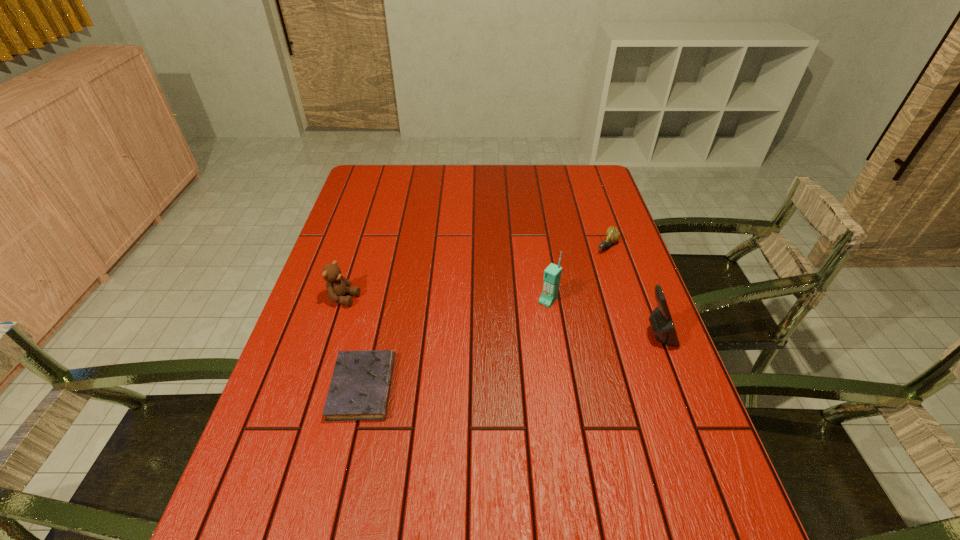
The height and width of the screenshot is (540, 960). Identify the location of free space between the nearest object and the third tallest object. (353, 342).

At what (x,y) coordinates should I click in order to perform the action: click on vacant area that lies between the shortest object and the teddy bear. Please return your answer as a coordinate pair (x, y). This screenshot has width=960, height=540. Looking at the image, I should click on (353, 342).

Locate an element on the screen. The height and width of the screenshot is (540, 960). free area in between the diary and the fourth farthest object is located at coordinates (510, 361).

Where is `vacant area between the second nearest object and the farthest object`? The image size is (960, 540). vacant area between the second nearest object and the farthest object is located at coordinates (632, 291).

Locate an element on the screen. vacant region between the third object from right to left and the right cellular telephone is located at coordinates (603, 318).

The height and width of the screenshot is (540, 960). Find the location of `free space between the diary and the left cellular telephone`. free space between the diary and the left cellular telephone is located at coordinates (455, 343).

What are the coordinates of `vacant space in between the nearer cellular telephone and the shortest object` in the screenshot? It's located at (510, 361).

Where is `blank region between the diary and the farther cellular telephone`? Image resolution: width=960 pixels, height=540 pixels. blank region between the diary and the farther cellular telephone is located at coordinates coord(455,343).

Identify the location of vacant space in between the third object from right to left and the second shortest object. (577, 273).

Locate which object ranks fourth in proximity to the third shortest object. Please provide its 2D coordinates. Your answer should be formatted as a tuple, i.e. [(x, y)], where the tuple contains the x and y coordinates of a point satisfying the conditions above.

[(660, 319)]